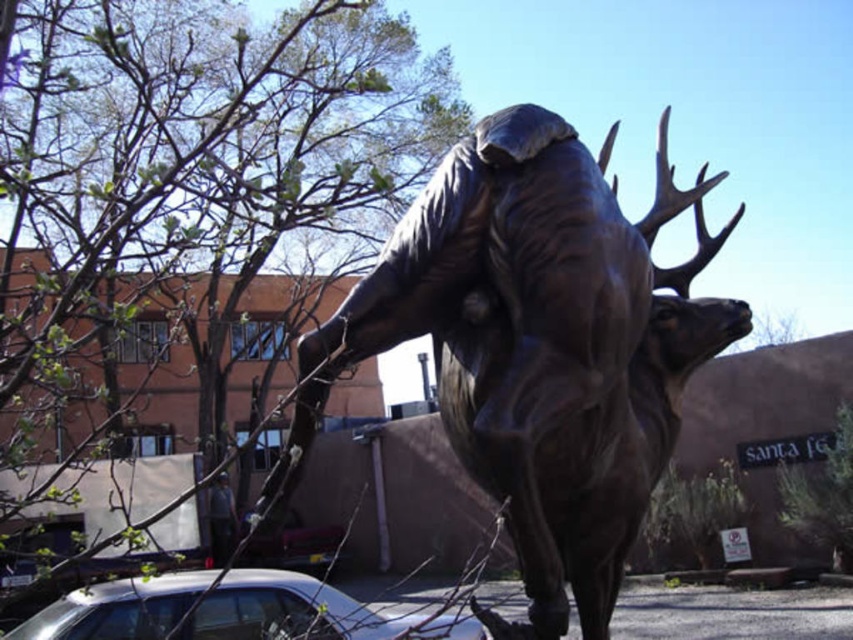
Describe the element at coordinates (532, 348) in the screenshot. I see `bronze statue at center` at that location.

Is point (462, 150) positioned in front of point (247, 570)?

Yes.

In the scene shown: Who is more forward, (476,397) or (248,596)?

Point (476,397) is in front.

I want to click on bronze statue at center, so click(x=532, y=348).

Is silver metallic car at lower left bigger than dark gray fabric at lower left?

Indeed, silver metallic car at lower left has a larger size compared to dark gray fabric at lower left.

Who is more forward, (177, 600) or (225, 528)?

Positioned in front is point (177, 600).

Locate an element on the screen. silver metallic car at lower left is located at coordinates (306, 612).

Is bronze statue at center smaller than dark gray fabric at lower left?

Incorrect, bronze statue at center is not smaller in size than dark gray fabric at lower left.

Does bronze statue at center have a greater height compared to dark gray fabric at lower left?

Indeed, bronze statue at center has a greater height compared to dark gray fabric at lower left.

This screenshot has height=640, width=853. What do you see at coordinates (532, 348) in the screenshot? I see `bronze statue at center` at bounding box center [532, 348].

Find the location of a particular element. The width and height of the screenshot is (853, 640). bronze statue at center is located at coordinates (532, 348).